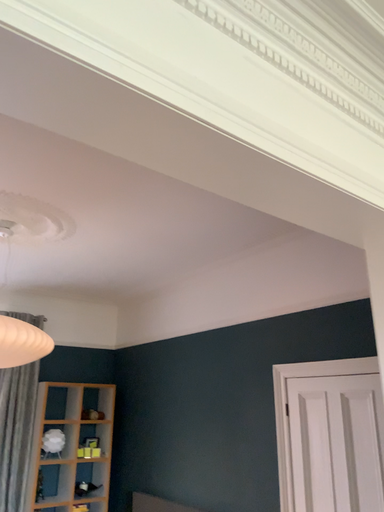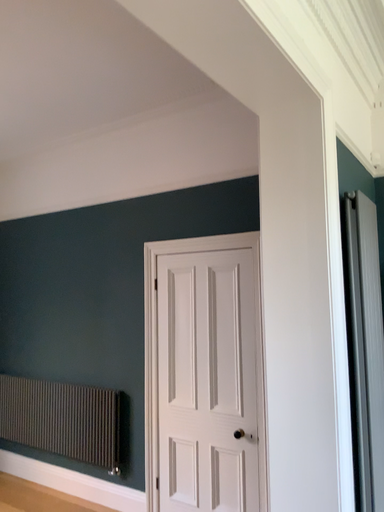
Question: How did the camera likely rotate when shooting the video?

Choices:
 (A) rotated downward
 (B) rotated upward

Answer: (A)